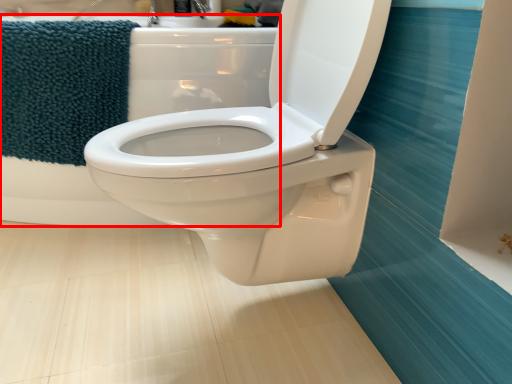
Question: Where is bath (annotated by the red box) located in relation to beach towel in the image?

Choices:
 (A) left
 (B) right

Answer: (B)